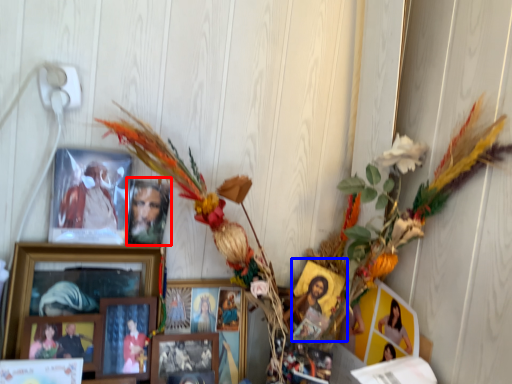
Question: Which object appears closest to the camera in this image, picture frame (highlighted by a red box) or picture frame (highlighted by a blue box)?

Choices:
 (A) picture frame
 (B) picture frame

Answer: (A)